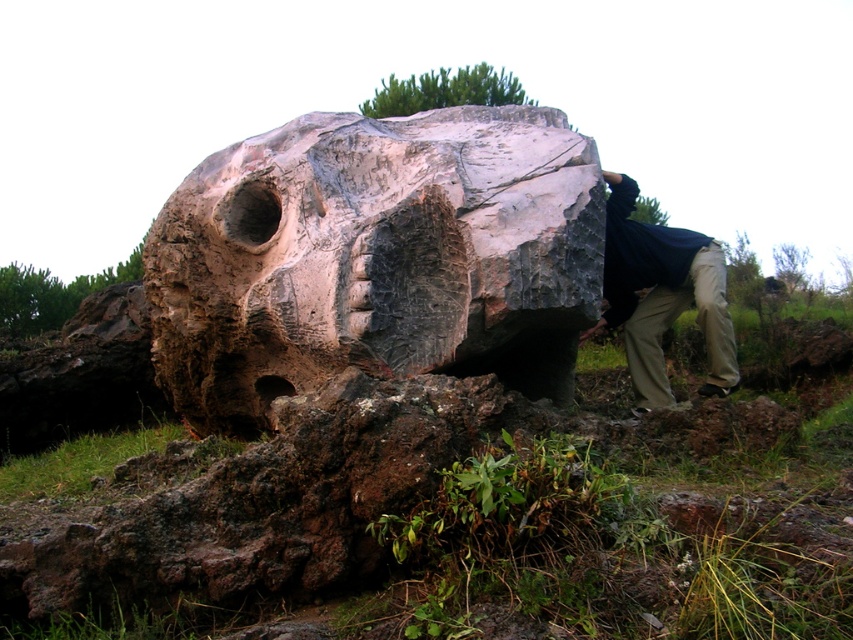
Looking at this image, you are standing in a grassy area with a large rock formation that has a human face carved into it. You notice a point marked at coordinates (376, 259). What object is located at that specific coordinate?

The rustic stone sculpture at center is located at point (376, 259).

You are a hiker who has spotted the rock formation and wants to place your khaki cotton pants at center and khaki pants at lower right near the base of the rock. Based on their heights, which pair of pants would you choose to place closer to the rock formation?

The khaki cotton pants at center has a greater height compared to the khaki pants at lower right, so you should place the khaki pants at lower right closer to the rock formation since it is shorter and less likely to block the view of the rock.